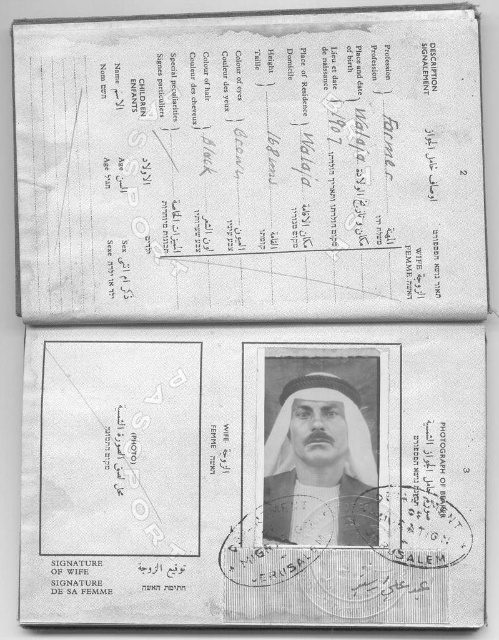
Can you confirm if black paper at lower right is positioned above black matte headscarf at center?

Actually, black paper at lower right is below black matte headscarf at center.

Between black paper at lower right and black matte headscarf at center, which one is positioned higher?

black matte headscarf at center is above.

Which is behind, point (317, 577) or point (306, 499)?

The point (306, 499) is more distant.

The height and width of the screenshot is (640, 499). Find the location of `black paper at lower right`. black paper at lower right is located at coordinates (253, 476).

Is white paper receipt at upper center closer to camera compared to black paper at lower right?

That is False.

Find the location of a particular element. This screenshot has width=499, height=640. white paper receipt at upper center is located at coordinates (250, 164).

Does white paper receipt at upper center come behind black matte headscarf at center?

Yes, white paper receipt at upper center is behind black matte headscarf at center.

Identify the location of white paper receipt at upper center. (250, 164).

Identify the location of white paper receipt at upper center. The image size is (499, 640). (250, 164).